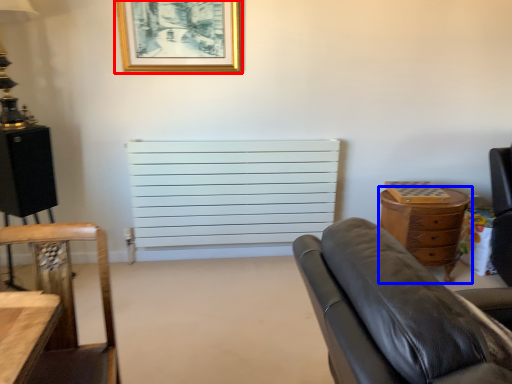
Question: Which point is further to the camera, picture frame (highlighted by a red box) or chest of drawers (highlighted by a blue box)?

Choices:
 (A) picture frame
 (B) chest of drawers

Answer: (B)